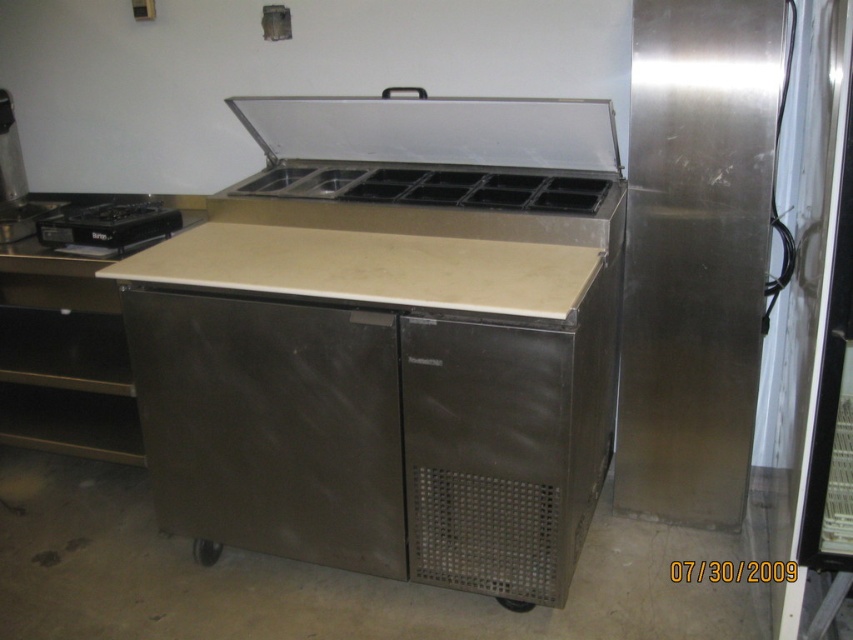
The width and height of the screenshot is (853, 640). What are the coordinates of `black matte gas stove at left` in the screenshot? It's located at (108, 225).

Does black matte gas stove at left appear on the right side of brushed metal drawer at lower left?

Indeed, black matte gas stove at left is positioned on the right side of brushed metal drawer at lower left.

Where is `black matte gas stove at left`? The width and height of the screenshot is (853, 640). black matte gas stove at left is located at coordinates (108, 225).

Where is `black matte gas stove at left`? Image resolution: width=853 pixels, height=640 pixels. black matte gas stove at left is located at coordinates (108, 225).

Who is shorter, stainless steel/reflective exhaust hood at center or brushed metal drawer at lower left?

Standing shorter between the two is brushed metal drawer at lower left.

How distant is stainless steel/reflective exhaust hood at center from brushed metal drawer at lower left?

The distance of stainless steel/reflective exhaust hood at center from brushed metal drawer at lower left is 33.48 inches.

Locate an element on the screen. The width and height of the screenshot is (853, 640). stainless steel/reflective exhaust hood at center is located at coordinates (434, 131).

You are a GUI agent. You are given a task and a screenshot of the screen. Output one action in this format:
    pyautogui.click(x=<x>, y=<y>)
    Task: Click on the stainless steel/reflective exhaust hood at center
    
    Given the screenshot: What is the action you would take?
    pyautogui.click(x=434, y=131)

Is stainless steel/reflective exhaust hood at center positioned before black matte gas stove at left?

Yes.

Looking at this image, who is more forward, (354, 99) or (62, 228)?

Point (354, 99) is in front.

I want to click on stainless steel/reflective exhaust hood at center, so click(434, 131).